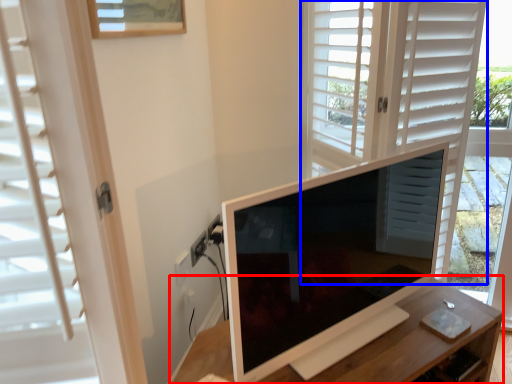
Question: Which point is closer to the camera, table (highlighted by a red box) or screen door (highlighted by a blue box)?

Choices:
 (A) table
 (B) screen door

Answer: (A)